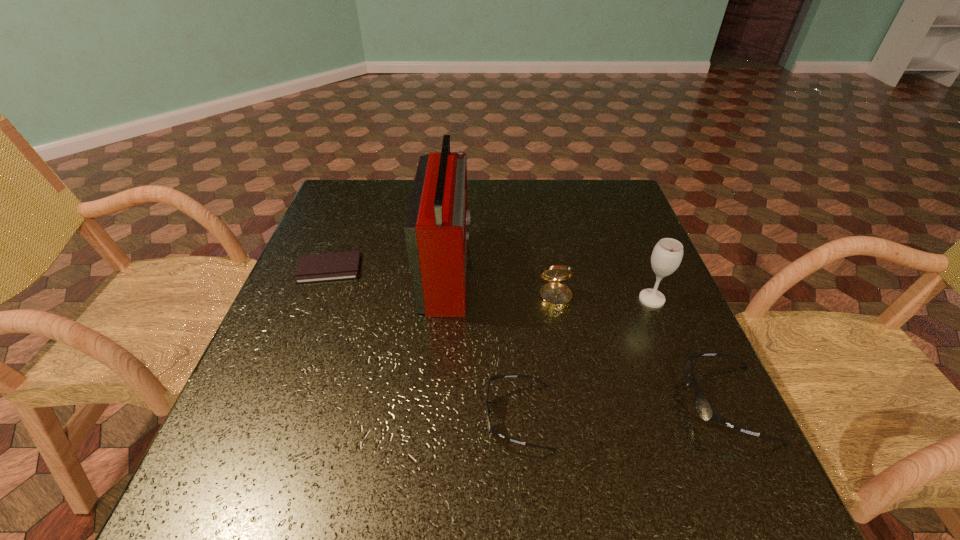
Identify the location of vacant space located with the dial facing the fourth shortest object. Image resolution: width=960 pixels, height=540 pixels. (581, 443).

In order to click on object that is positioned at the left edge in this screenshot , I will do `click(334, 266)`.

The height and width of the screenshot is (540, 960). I want to click on sunglasses that is at the right edge, so click(x=704, y=409).

Identify the location of wineglass at the right edge. This screenshot has width=960, height=540. (667, 254).

I want to click on object at the near right corner, so click(704, 409).

The image size is (960, 540). Find the location of `free spot at the far edge of the desktop`. free spot at the far edge of the desktop is located at coordinates (502, 199).

Image resolution: width=960 pixels, height=540 pixels. What are the coordinates of `free space at the near edge` in the screenshot? It's located at (476, 424).

Identify the location of vacant space at the left edge of the desktop. This screenshot has height=540, width=960. (322, 235).

At what (x,y) coordinates should I click in order to perform the action: click on free space at the right edge. Please return your answer as a coordinate pair (x, y). This screenshot has width=960, height=540. Looking at the image, I should click on (645, 320).

The width and height of the screenshot is (960, 540). Find the location of `vacant space at the far left corner`. vacant space at the far left corner is located at coordinates (330, 202).